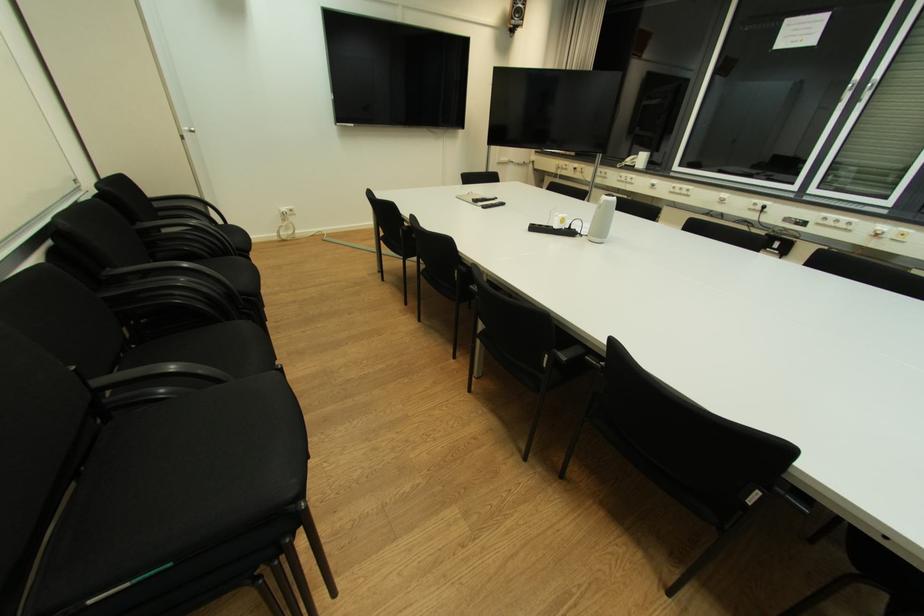
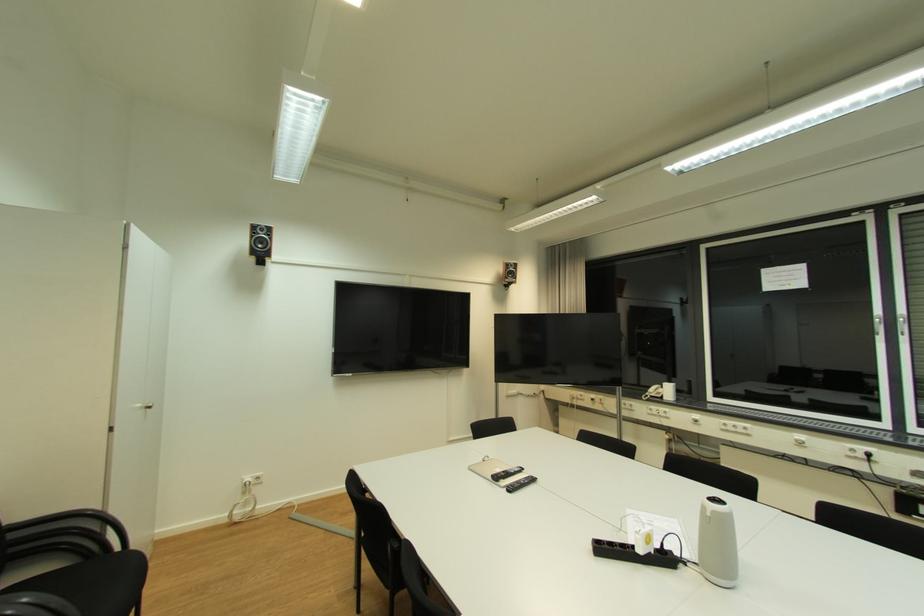
Find the pixel in the second image that matches the point at 289,209 in the first image.

(253, 480)